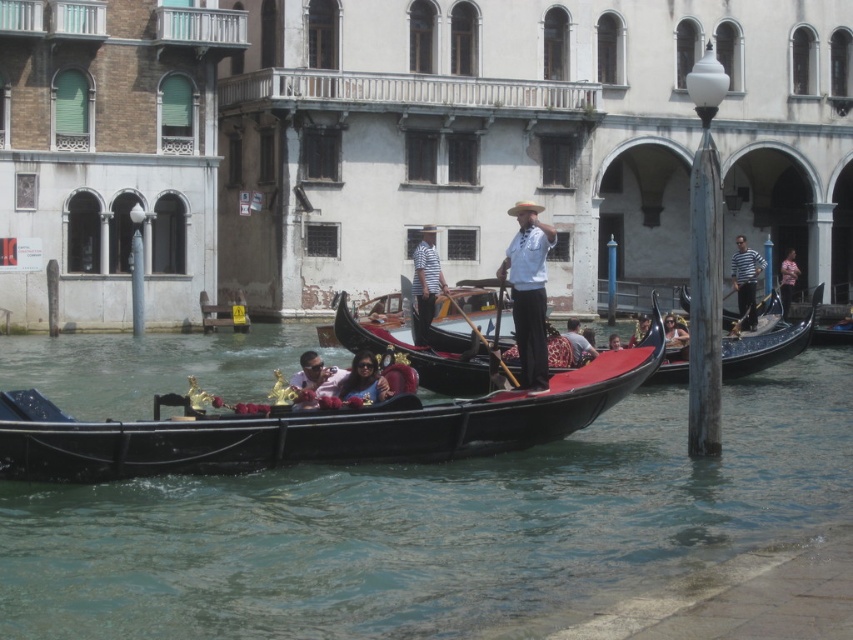
Question: Can you confirm if white cotton shirt at center is thinner than striped shirt at center?

Choices:
 (A) no
 (B) yes

Answer: (A)

Question: Estimate the real-world distances between objects in this image. Which object is farther from the striped shirt at center?

Choices:
 (A) white cotton shirt at center
 (B) matte black sunglasses at center
 (C) matte pink fabric at center

Answer: (B)

Question: Can you confirm if striped shirt at center is bigger than matte black sunglasses at center?

Choices:
 (A) yes
 (B) no

Answer: (A)

Question: Estimate the real-world distances between objects in this image. Which object is closer to the striped cotton shirt at center?

Choices:
 (A) matte black sunglasses at center
 (B) black polished gondola at center
 (C) shiny black gondola at center

Answer: (B)

Question: Can you confirm if white cotton shirt at center is thinner than striped shirt at center?

Choices:
 (A) yes
 (B) no

Answer: (B)

Question: Which object is the farthest from the matte black sunglasses at center?

Choices:
 (A) white cotton shirt at center
 (B) matte pink fabric at center

Answer: (A)